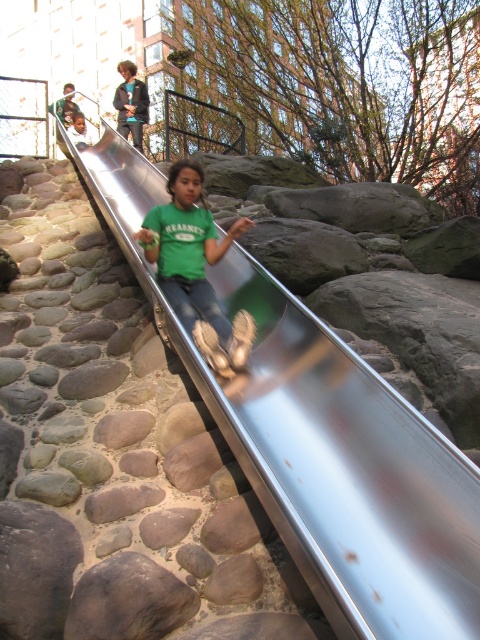
Based on the photo, does metallic smooth slide at center appear on the right side of green matte shirt at center?

Correct, you'll find metallic smooth slide at center to the right of green matte shirt at center.

Can you confirm if metallic smooth slide at center is positioned to the left of green matte shirt at center?

Incorrect, metallic smooth slide at center is not on the left side of green matte shirt at center.

Which is behind, point (267, 417) or point (169, 212)?

Positioned behind is point (169, 212).

Where is `metallic smooth slide at center`? Image resolution: width=480 pixels, height=640 pixels. metallic smooth slide at center is located at coordinates (323, 442).